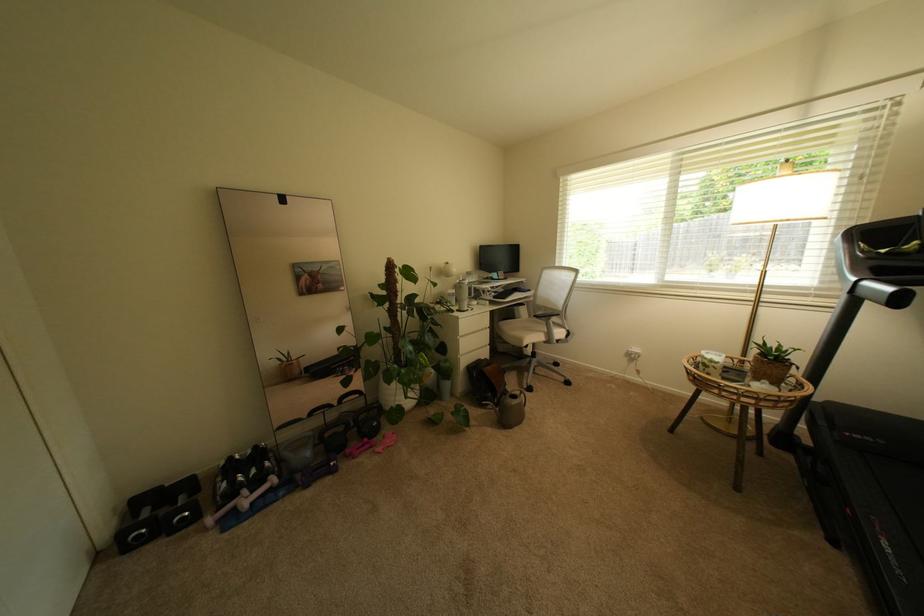
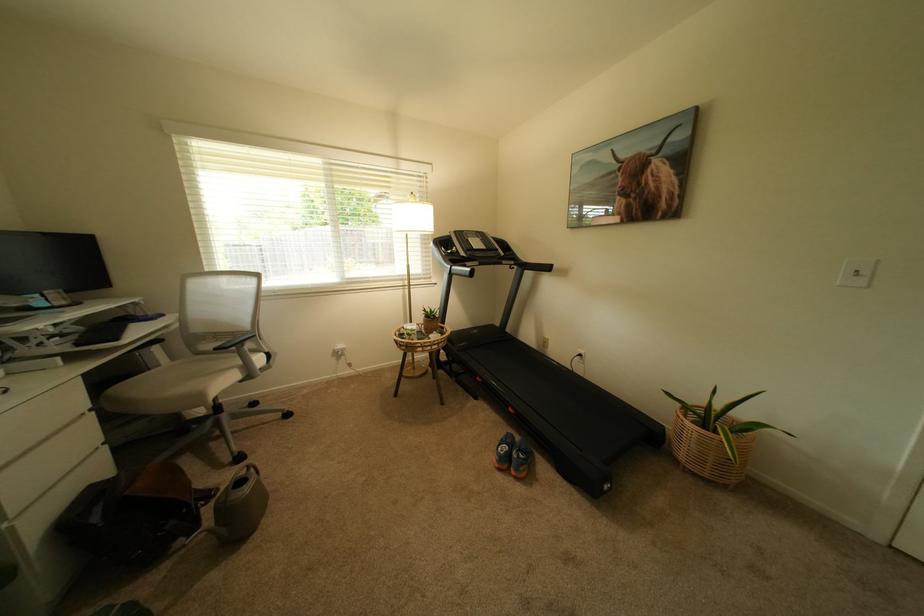
In the second image, find the point that corresponds to (523,320) in the first image.

(157, 370)